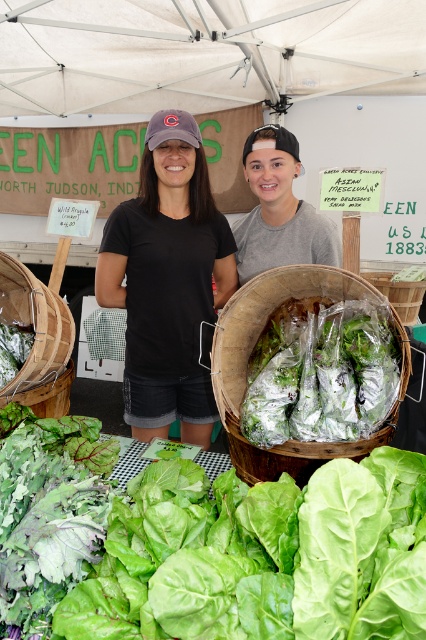
You are a customer at the farmer market stall. You see the green leafy lettuce at center and the wooden basket at lower left. Which item is closer to you?

The green leafy lettuce at center is closer to the viewer than the wooden basket at lower left.